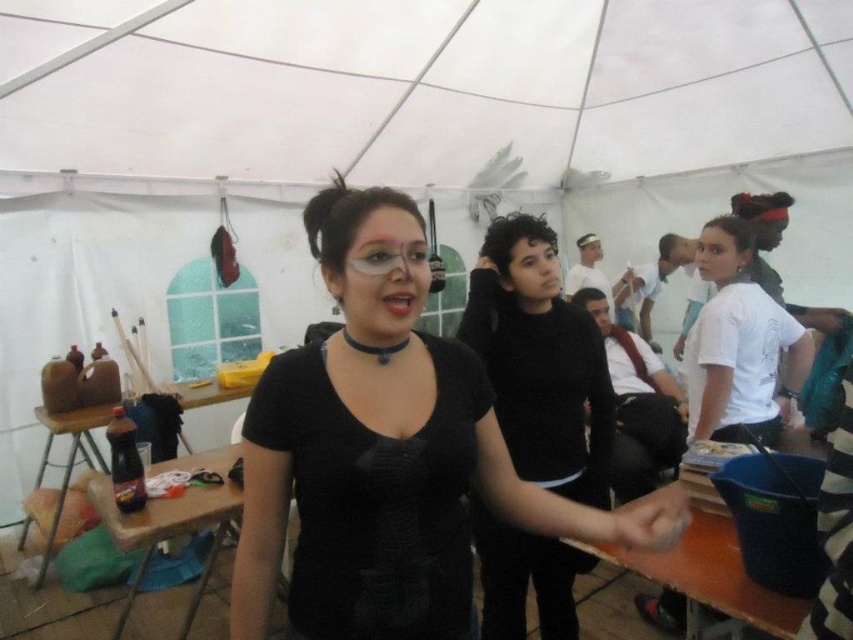
Can you confirm if matte black shirt at center is positioned to the right of brown plastic table at lower left?

Yes, matte black shirt at center is to the right of brown plastic table at lower left.

At what (x,y) coordinates should I click in order to perform the action: click on matte black shirt at center. Please return your answer as a coordinate pair (x, y). The height and width of the screenshot is (640, 853). Looking at the image, I should click on (387, 452).

Where is `matte black shirt at center`? This screenshot has width=853, height=640. matte black shirt at center is located at coordinates (387, 452).

Is point (723, 387) positioned behind point (717, 600)?

Yes, it is behind point (717, 600).

Is white matte shirt at upper right shorter than brown wooden table at lower right?

No, white matte shirt at upper right is not shorter than brown wooden table at lower right.

The width and height of the screenshot is (853, 640). I want to click on white matte shirt at upper right, so click(x=738, y=342).

Where is `white matte shirt at upper right`? This screenshot has width=853, height=640. white matte shirt at upper right is located at coordinates (738, 342).

Which is above, matte black shirt at center or black matte sweater at center?

black matte sweater at center

Who is more forward, (326, 461) or (583, 488)?

Point (326, 461) is more forward.

This screenshot has width=853, height=640. In order to click on matte black shirt at center in this screenshot , I will do click(x=387, y=452).